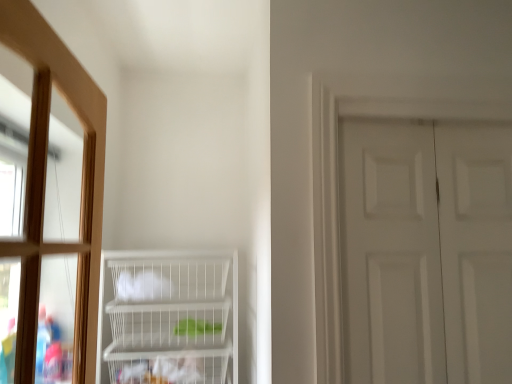
Question: Would you say white matte door at right is to the left or to the right of clear glass window at left in the picture?

Choices:
 (A) right
 (B) left

Answer: (A)

Question: In terms of size, does white matte door at right appear bigger or smaller than clear glass window at left?

Choices:
 (A) small
 (B) big

Answer: (A)

Question: Estimate the real-world distances between objects in this image. Which object is farther from the white wire basket at lower center?

Choices:
 (A) clear glass window at left
 (B) white matte door at right

Answer: (B)

Question: Which is nearer to the white wire basket at lower center?

Choices:
 (A) clear glass window at left
 (B) white matte door at right

Answer: (A)